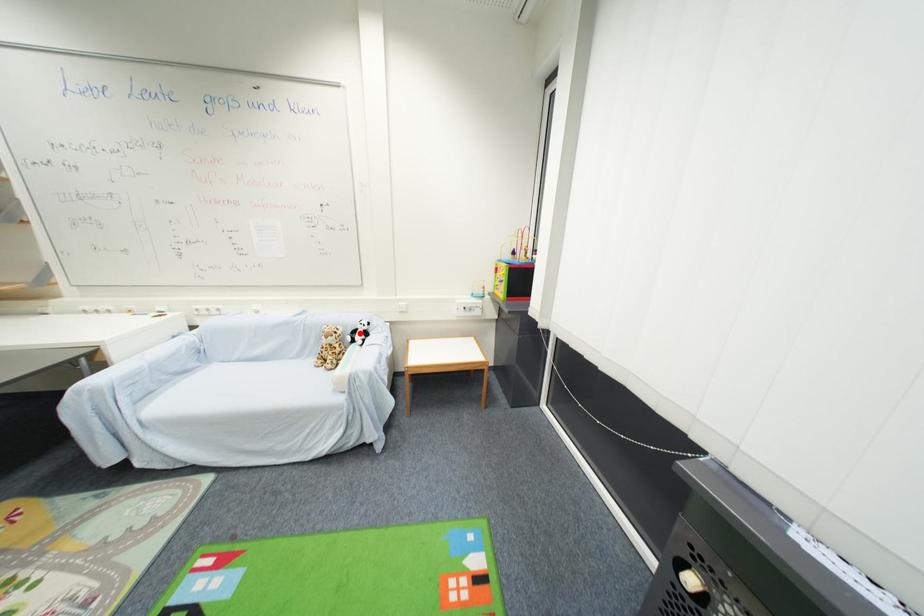
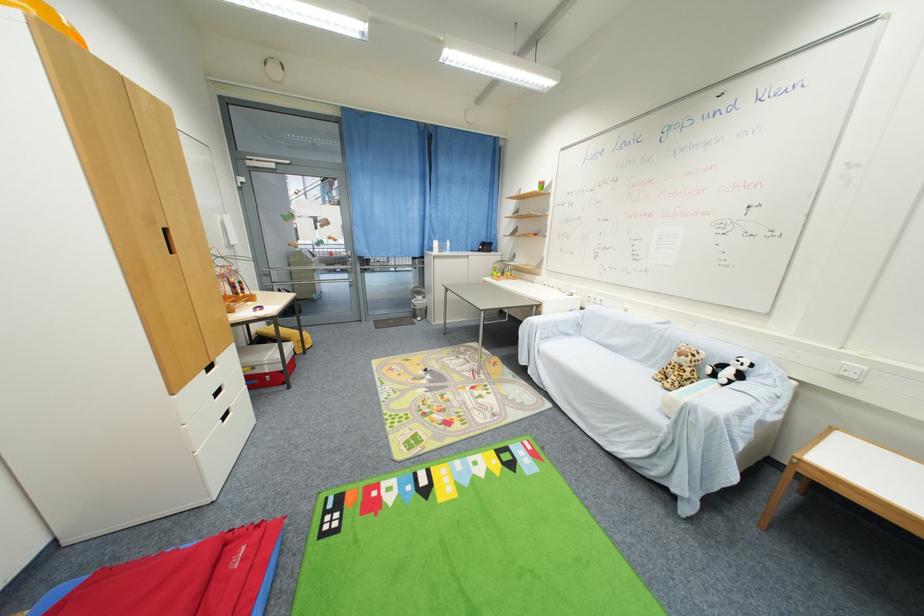
Where in the second image is the point corresponding to the highlighted location from the first image?

(727, 368)